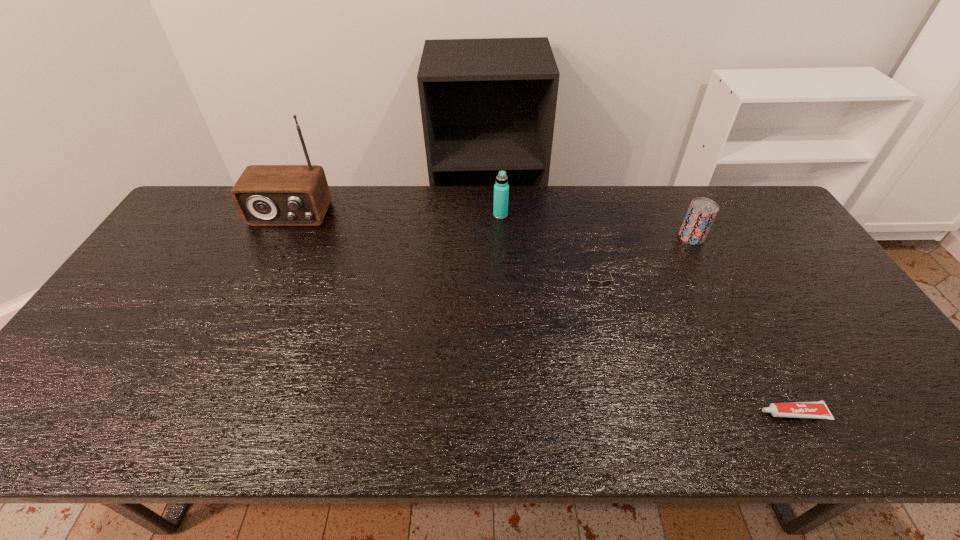
At what (x,y) coordinates should I click in order to perform the action: click on free spot that satisfies the following two spatial constraints: 1. on the front-facing side of the third tallest object; 2. on the right side of the radio receiver. Please return your answer as a coordinate pair (x, y). This screenshot has width=960, height=540. Looking at the image, I should click on (279, 237).

Where is `free region that satisfies the following two spatial constraints: 1. on the front-facing side of the third tallest object; 2. on the right side of the leftmost object`? free region that satisfies the following two spatial constraints: 1. on the front-facing side of the third tallest object; 2. on the right side of the leftmost object is located at coordinates (279, 237).

Image resolution: width=960 pixels, height=540 pixels. Identify the location of free space that satisfies the following two spatial constraints: 1. on the front-facing side of the third shortest object; 2. on the right side of the leftmost object. (279, 237).

I want to click on vacant area in the image that satisfies the following two spatial constraints: 1. on the front-facing side of the water bottle; 2. on the right side of the leftmost object, so click(290, 215).